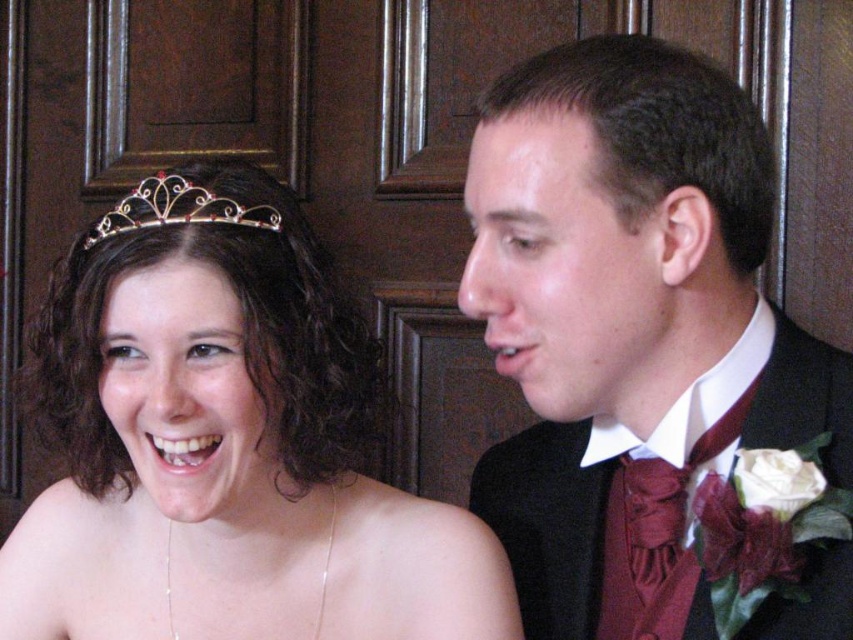
Question: Which point is closer to the camera?

Choices:
 (A) matte black suit at right
 (B) silver/golden metallic tiara at upper left
 (C) matte gold tiara at upper left

Answer: (A)

Question: Considering the real-world distances, which object is closest to the matte black suit at right?

Choices:
 (A) matte gold tiara at upper left
 (B) silver/golden metallic tiara at upper left

Answer: (A)

Question: Does matte gold tiara at upper left appear over silver/golden metallic tiara at upper left?

Choices:
 (A) no
 (B) yes

Answer: (A)

Question: Is matte gold tiara at upper left to the left of silver/golden metallic tiara at upper left from the viewer's perspective?

Choices:
 (A) yes
 (B) no

Answer: (B)

Question: Which object is the farthest from the matte black suit at right?

Choices:
 (A) matte gold tiara at upper left
 (B) silver/golden metallic tiara at upper left

Answer: (B)

Question: Is matte black suit at right in front of matte gold tiara at upper left?

Choices:
 (A) yes
 (B) no

Answer: (A)